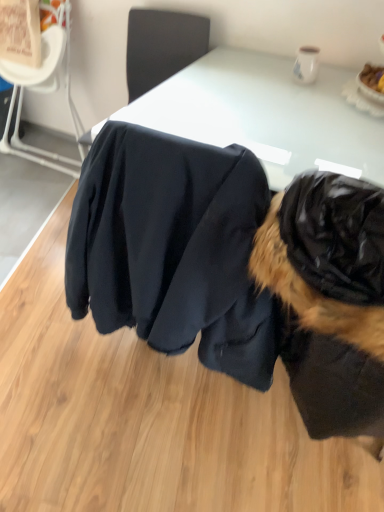
Question: Could you tell me if white glossy table at center is facing matte black jacket at center?

Choices:
 (A) yes
 (B) no

Answer: (A)

Question: From a real-world perspective, is white glossy table at center below matte black jacket at center?

Choices:
 (A) yes
 (B) no

Answer: (B)

Question: Considering the relative positions of white glossy table at center and matte black jacket at center in the image provided, is white glossy table at center to the left of matte black jacket at center from the viewer's perspective?

Choices:
 (A) no
 (B) yes

Answer: (A)

Question: From the image's perspective, is white glossy table at center over matte black jacket at center?

Choices:
 (A) no
 (B) yes

Answer: (B)

Question: Is white glossy table at center not inside matte black jacket at center?

Choices:
 (A) no
 (B) yes

Answer: (B)

Question: Can you confirm if white glossy table at center is thinner than matte black jacket at center?

Choices:
 (A) yes
 (B) no

Answer: (B)

Question: From a real-world perspective, does black fabric chair at upper left, the 1th chair from the left, sit lower than black fur coat at right?

Choices:
 (A) yes
 (B) no

Answer: (B)

Question: Is black fabric chair at upper left, the second chair when ordered from right to left, closer to camera compared to black fur coat at right?

Choices:
 (A) yes
 (B) no

Answer: (B)

Question: From a real-world perspective, is black fabric chair at upper left, the second chair when ordered from right to left, on black fur coat at right?

Choices:
 (A) yes
 (B) no

Answer: (A)

Question: Can you confirm if black fabric chair at upper left, the 1th chair from the left, is wider than black fur coat at right?

Choices:
 (A) no
 (B) yes

Answer: (A)

Question: From the image's perspective, is black fabric chair at upper left, the second chair when ordered from right to left, located above black fur coat at right?

Choices:
 (A) no
 (B) yes

Answer: (B)

Question: Is the position of black fabric chair at upper left, the second chair when ordered from right to left, more distant than that of black fur coat at right?

Choices:
 (A) no
 (B) yes

Answer: (B)

Question: Are white glossy table at center and black fabric chair at upper center, which is counted as the second chair, starting from the left, beside each other?

Choices:
 (A) no
 (B) yes

Answer: (A)